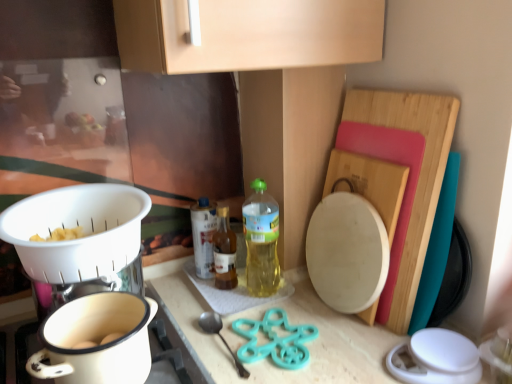
Where is `vacant space in front of translucent glass bottle at center, acting as the 2th bottle starting from the right`? This screenshot has height=384, width=512. vacant space in front of translucent glass bottle at center, acting as the 2th bottle starting from the right is located at coordinates (232, 305).